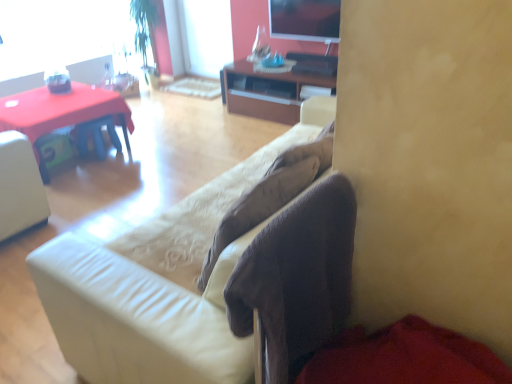
Locate an element on the screen. matte black tv at upper center is located at coordinates (305, 19).

What do you see at coordinates (132, 320) in the screenshot?
I see `suede-like beige couch at center` at bounding box center [132, 320].

What is the approximate height of brown wood cabinet at center?

17.91 inches.

Where is `matte black tv at upper center`? The height and width of the screenshot is (384, 512). matte black tv at upper center is located at coordinates (305, 19).

Which is more to the left, matte black tv at upper center or matte plastic desk at left?

A: Positioned to the left is matte plastic desk at left.

Which of these two, matte black tv at upper center or matte plastic desk at left, is bigger?

With larger size is matte plastic desk at left.

Is point (337, 38) closer or farther from the camera than point (87, 112)?

Point (337, 38).

Which is farther, (183, 316) or (321, 29)?

Point (321, 29)

Considering the sizes of suede-like beige couch at center and matte black tv at upper center in the image, is suede-like beige couch at center wider or thinner than matte black tv at upper center?

Clearly, suede-like beige couch at center has more width compared to matte black tv at upper center.

Is suede-like beige couch at center further to camera compared to matte black tv at upper center?

No, it is in front of matte black tv at upper center.

Is suede-like beige couch at center positioned with its back to matte black tv at upper center?

No, suede-like beige couch at center is not facing away from matte black tv at upper center.

From a real-world perspective, is matte plastic desk at left on suede-like beige couch at center?

No, from a real-world perspective, matte plastic desk at left is not on top of suede-like beige couch at center.

Is matte plastic desk at left with suede-like beige couch at center?

No, matte plastic desk at left is not with suede-like beige couch at center.

Visually, is matte plastic desk at left positioned to the left or to the right of suede-like beige couch at center?

From the image, it's evident that matte plastic desk at left is to the left of suede-like beige couch at center.

Is matte plastic desk at left aimed at suede-like beige couch at center?

Yes, matte plastic desk at left is oriented towards suede-like beige couch at center.

From the image's perspective, is matte plastic desk at left beneath matte black tv at upper center?

Yes, from the image's perspective, matte plastic desk at left is below matte black tv at upper center.

From the picture: Which is correct: matte plastic desk at left is inside matte black tv at upper center, or outside of it?

matte plastic desk at left is outside matte black tv at upper center.

Is matte plastic desk at left at the right side of matte black tv at upper center?

No, matte plastic desk at left is not to the right of matte black tv at upper center.

Can you confirm if matte black tv at upper center is smaller than brown wood cabinet at center?

Yes.

Is matte black tv at upper center beside brown wood cabinet at center?

matte black tv at upper center and brown wood cabinet at center are not in contact.

Can you confirm if matte black tv at upper center is wider than brown wood cabinet at center?

No.

From a real-world perspective, which is physically above, matte black tv at upper center or brown wood cabinet at center?

From a 3D spatial view, matte black tv at upper center is above.

Is brown wood cabinet at center looking in the opposite direction of matte plastic desk at left?

No, matte plastic desk at left is not at the back of brown wood cabinet at center.

Considering the points (289, 102) and (73, 111), which point is behind, point (289, 102) or point (73, 111)?

The point (289, 102) is farther from the camera.

From the image's perspective, which is below, brown wood cabinet at center or matte plastic desk at left?

matte plastic desk at left, from the image's perspective.

Does brown wood cabinet at center lie behind matte plastic desk at left?

That is True.

Looking at this image, looking at the image, does brown wood cabinet at center seem bigger or smaller compared to suede-like beige couch at center?

Considering their sizes, brown wood cabinet at center takes up less space than suede-like beige couch at center.

Could you tell me if brown wood cabinet at center is turned towards suede-like beige couch at center?

Yes, brown wood cabinet at center faces towards suede-like beige couch at center.

Would you say brown wood cabinet at center is inside or outside suede-like beige couch at center?

brown wood cabinet at center is not inside suede-like beige couch at center, it's outside.

From a real-world perspective, is brown wood cabinet at center physically below suede-like beige couch at center?

Yes, from a real-world perspective, brown wood cabinet at center is below suede-like beige couch at center.

Where is `desk that appears in front of the matte black tv at upper center`? The image size is (512, 384). desk that appears in front of the matte black tv at upper center is located at coordinates (60, 109).

Where is `television behind the suede-like beige couch at center`? The image size is (512, 384). television behind the suede-like beige couch at center is located at coordinates (305, 19).

Looking at the image, which one is located further to matte black tv at upper center, suede-like beige couch at center or matte plastic desk at left?

suede-like beige couch at center is further to matte black tv at upper center.

Which object lies nearer to the anchor point matte plastic desk at left, matte black tv at upper center or brown wood cabinet at center?

The object closer to matte plastic desk at left is brown wood cabinet at center.

From the image, which object appears to be farther from matte black tv at upper center, matte plastic desk at left or suede-like beige couch at center?

suede-like beige couch at center lies further to matte black tv at upper center than the other object.

Looking at this image, from the image, which object appears to be farther from brown wood cabinet at center, matte black tv at upper center or matte plastic desk at left?

matte plastic desk at left is positioned further to the anchor brown wood cabinet at center.

Considering their positions, is matte black tv at upper center positioned further to suede-like beige couch at center than brown wood cabinet at center?

The object further to suede-like beige couch at center is matte black tv at upper center.

From the image, which object appears to be farther from matte black tv at upper center, brown wood cabinet at center or matte plastic desk at left?

Among the two, matte plastic desk at left is located further to matte black tv at upper center.

Which object lies nearer to the anchor point suede-like beige couch at center, matte plastic desk at left or matte black tv at upper center?

matte plastic desk at left is positioned closer to the anchor suede-like beige couch at center.

Which object lies further to the anchor point matte plastic desk at left, suede-like beige couch at center or matte black tv at upper center?

suede-like beige couch at center is positioned further to the anchor matte plastic desk at left.

Locate an element on the screen. desk located between suede-like beige couch at center and brown wood cabinet at center in the depth direction is located at coordinates (60, 109).

The width and height of the screenshot is (512, 384). I want to click on cabinetry between suede-like beige couch at center and matte black tv at upper center in the front-back direction, so click(267, 91).

Find the location of a particular element. cabinetry between matte plastic desk at left and matte black tv at upper center is located at coordinates (267, 91).

I want to click on desk between suede-like beige couch at center and matte black tv at upper center in the front-back direction, so click(60, 109).